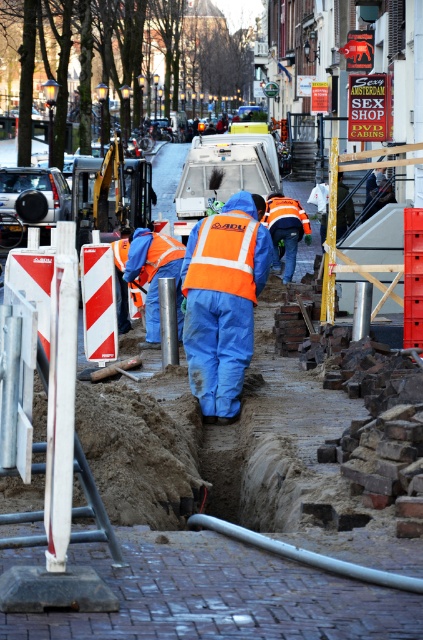
Who is taller, orange reflective jacket at center or reflective orange vest at center?

orange reflective jacket at center is taller.

The height and width of the screenshot is (640, 423). Describe the element at coordinates (222, 301) in the screenshot. I see `orange reflective jacket at center` at that location.

The height and width of the screenshot is (640, 423). I want to click on orange reflective jacket at center, so click(222, 301).

Identify the location of orange reflective jacket at center. This screenshot has width=423, height=640. (222, 301).

Does point (225, 374) lie in front of point (247, 276)?

That is False.

Describe the element at coordinates (222, 301) in the screenshot. This screenshot has height=640, width=423. I see `orange reflective jacket at center` at that location.

Where is `orange reflective jacket at center`? The height and width of the screenshot is (640, 423). orange reflective jacket at center is located at coordinates (222, 301).

Locate an element on the screen. This screenshot has height=640, width=423. orange reflective safety vest at center is located at coordinates pyautogui.click(x=224, y=253).

Does orange reflective safety vest at center appear under reflective orange vest at center?

Actually, orange reflective safety vest at center is above reflective orange vest at center.

This screenshot has height=640, width=423. What do you see at coordinates (224, 253) in the screenshot?
I see `orange reflective safety vest at center` at bounding box center [224, 253].

Find the location of `orange reflective safety vest at center`. orange reflective safety vest at center is located at coordinates (224, 253).